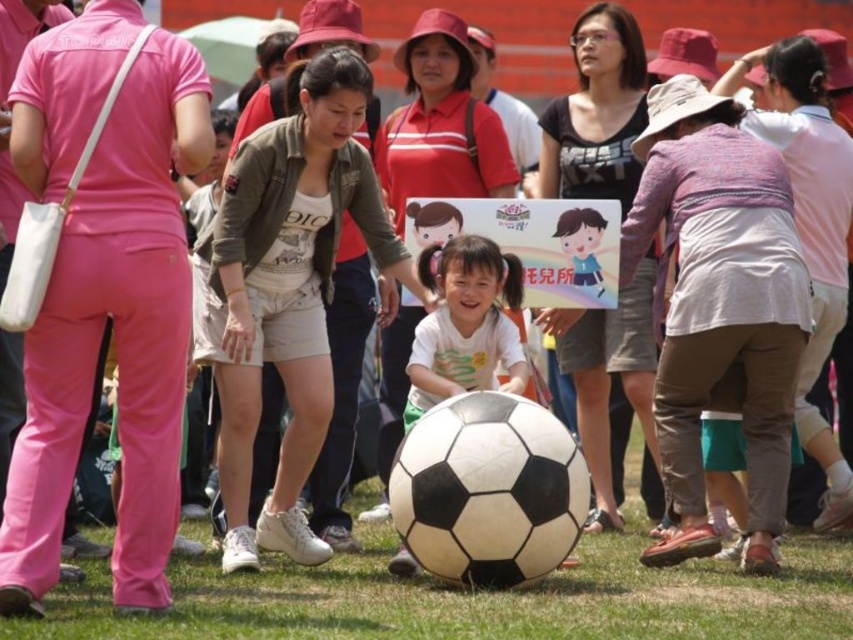
You are a photographer trying to capture a photo of the matte green jacket at center and the matte white shirt at center. Based on their heights, which one should you focus on first if you want to ensure both are fully visible in the frame?

The matte white shirt at center is taller than the matte green jacket at center. Therefore, you should focus on the matte white shirt at center first to ensure it fits within the frame, as it is taller and might require adjusting the camera angle or zoom to accommodate its height while still including the shorter matte green jacket at center.

You are a photographer trying to capture a photo of the green grass at center and the matte black shirt at center. Based on the scene description, which object appears wider in the image?

The green grass at center appears wider than the matte black shirt at center because its width is larger.